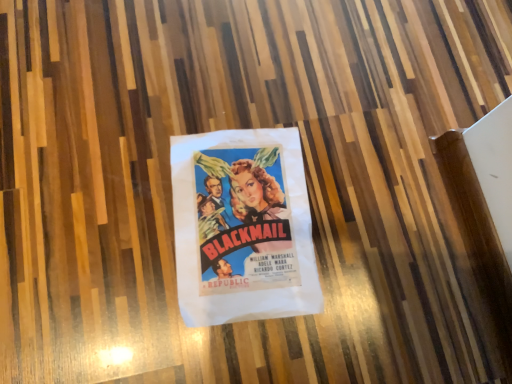
Find the location of a particular element. Image resolution: width=512 pixels, height=384 pixels. blank space above white paper poster at center (from a real-world perspective) is located at coordinates (245, 220).